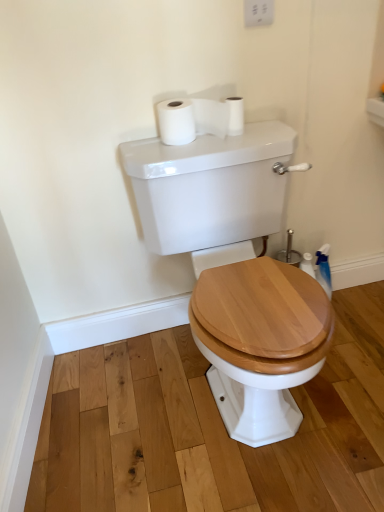
The height and width of the screenshot is (512, 384). What are the coordinates of `free space to the left of white glossy porcelain at center` in the screenshot? It's located at (109, 412).